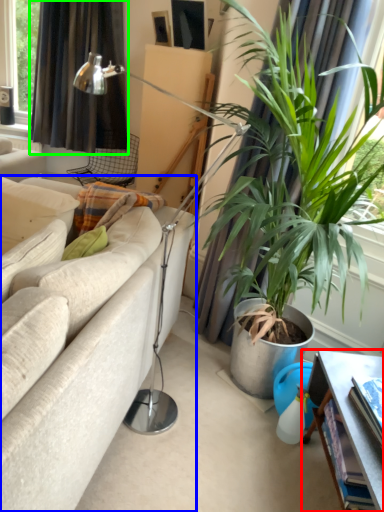
Question: Which object is the farthest from table (highlighted by a red box)? Choose among these: studio couch (highlighted by a blue box) or curtain (highlighted by a green box).

Choices:
 (A) studio couch
 (B) curtain

Answer: (B)